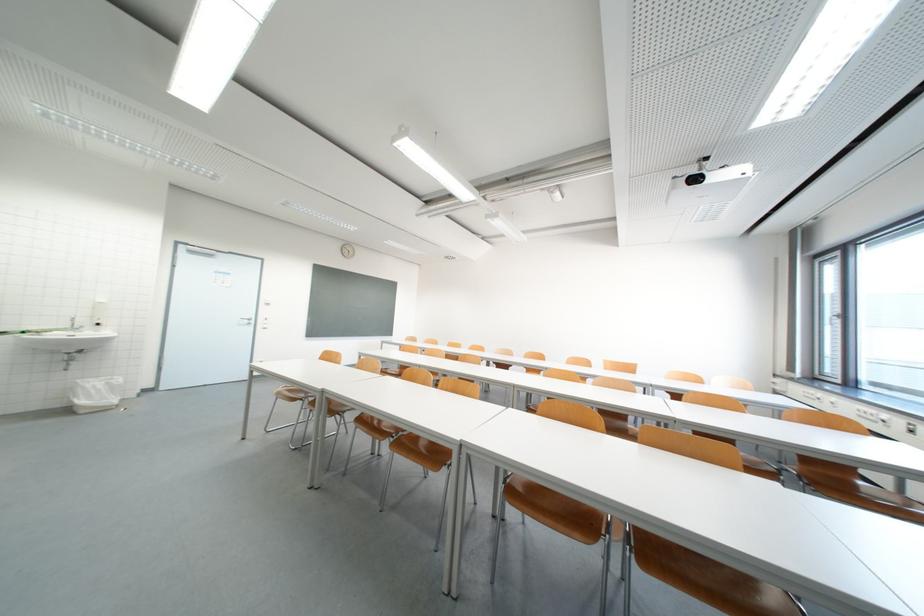
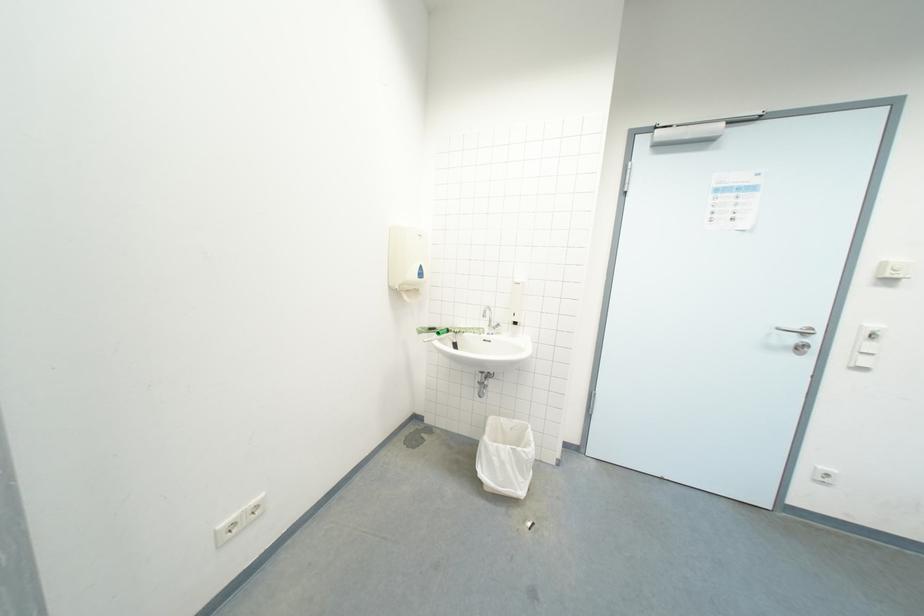
Where in the second image is the point corresponding to point 91,403 from the first image?

(492, 475)